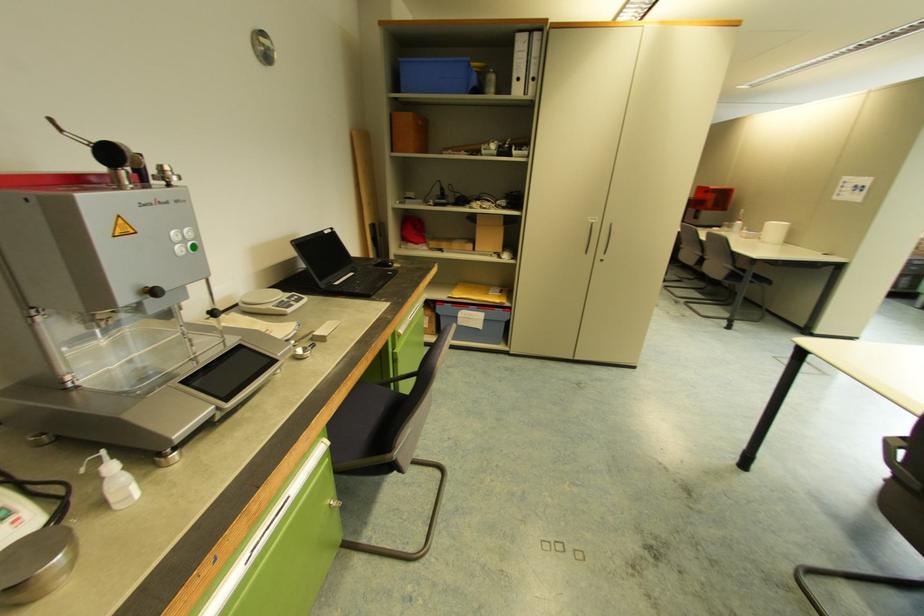
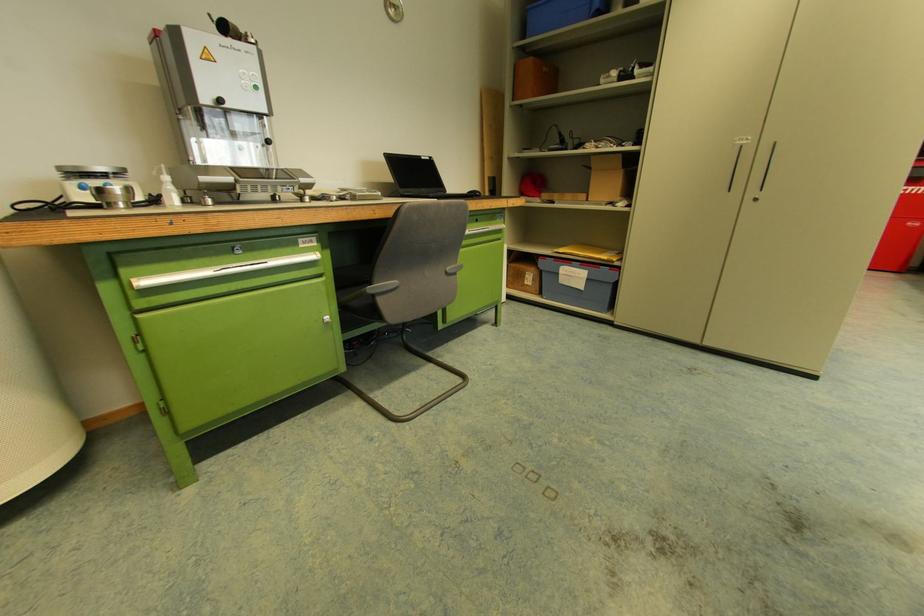
Where in the second image is the point corresponding to pixel 392 456 from the first image?

(368, 290)